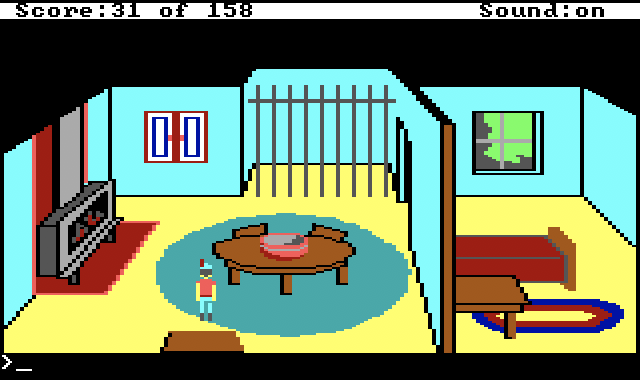
Where is `red bedspread`? This screenshot has height=380, width=640. red bedspread is located at coordinates (509, 249).